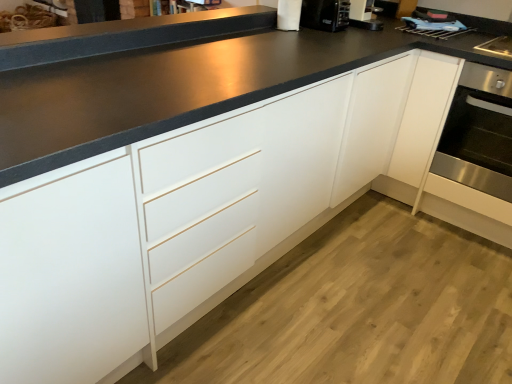
Question: Considering the relative positions of black matte countertop at upper center and white paper towel at upper center in the image provided, is black matte countertop at upper center to the right of white paper towel at upper center from the viewer's perspective?

Choices:
 (A) no
 (B) yes

Answer: (A)

Question: Can you confirm if black matte countertop at upper center is thinner than white paper towel at upper center?

Choices:
 (A) no
 (B) yes

Answer: (A)

Question: Can you confirm if black matte countertop at upper center is shorter than white paper towel at upper center?

Choices:
 (A) yes
 (B) no

Answer: (A)

Question: Can you confirm if black matte countertop at upper center is positioned to the left of white paper towel at upper center?

Choices:
 (A) yes
 (B) no

Answer: (A)

Question: Is black matte countertop at upper center outside of white paper towel at upper center?

Choices:
 (A) yes
 (B) no

Answer: (A)

Question: Would you say white paper towel at upper center is inside or outside black plastic coffee machine at upper right?

Choices:
 (A) inside
 (B) outside

Answer: (B)

Question: Considering the positions of point (293, 9) and point (330, 23), is point (293, 9) closer or farther from the camera than point (330, 23)?

Choices:
 (A) closer
 (B) farther

Answer: (A)

Question: Based on their positions, is white paper towel at upper center located to the left or right of black plastic coffee machine at upper right?

Choices:
 (A) left
 (B) right

Answer: (A)

Question: Relative to black plastic coffee machine at upper right, is white paper towel at upper center in front or behind?

Choices:
 (A) behind
 (B) front

Answer: (B)

Question: Is black plastic coffee machine at upper right wider or thinner than black matte countertop at upper center?

Choices:
 (A) thin
 (B) wide

Answer: (B)

Question: Visually, is black plastic coffee machine at upper right positioned to the left or to the right of black matte countertop at upper center?

Choices:
 (A) right
 (B) left

Answer: (A)

Question: Is black plastic coffee machine at upper right taller or shorter than black matte countertop at upper center?

Choices:
 (A) tall
 (B) short

Answer: (B)

Question: Is black plastic coffee machine at upper right bigger or smaller than black matte countertop at upper center?

Choices:
 (A) small
 (B) big

Answer: (A)

Question: Is white paper towel at upper center bigger or smaller than stainless steel oven at right?

Choices:
 (A) small
 (B) big

Answer: (A)

Question: From a real-world perspective, is white paper towel at upper center positioned above or below stainless steel oven at right?

Choices:
 (A) below
 (B) above

Answer: (B)